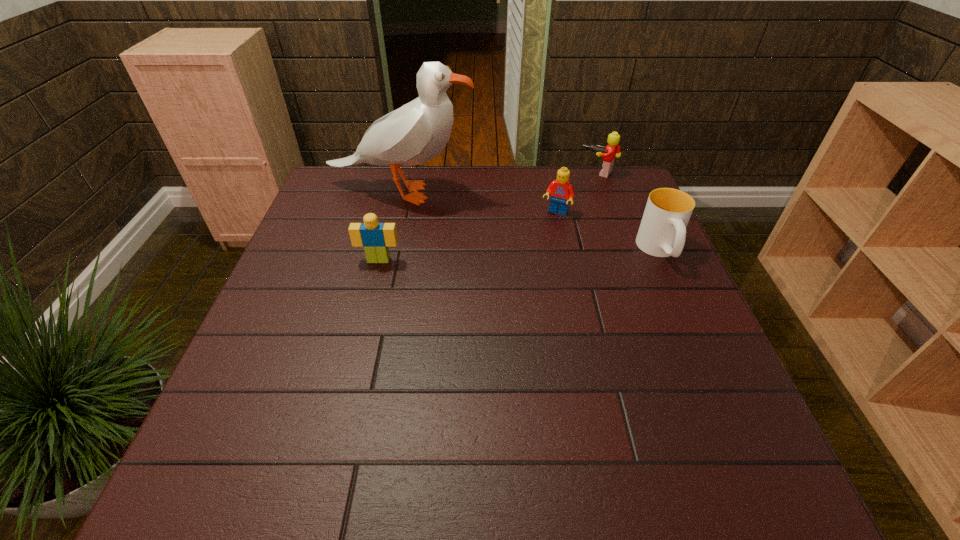
You are a GUI agent. You are given a task and a screenshot of the screen. Output one action in this format:
    pyautogui.click(x=<x>, y=<y>)
    Task: Click on the Lego that is at the right edge
    Image resolution: width=960 pixels, height=540 pixels.
    Given the screenshot: What is the action you would take?
    pyautogui.click(x=612, y=150)

Locate an element on the screen. This screenshot has height=540, width=960. object present at the far left corner is located at coordinates (415, 133).

Find the location of `object at the far right corner`. object at the far right corner is located at coordinates (612, 150).

Where is `free space at the far edge of the desktop`? Image resolution: width=960 pixels, height=540 pixels. free space at the far edge of the desktop is located at coordinates (477, 201).

At what (x,y) coordinates should I click in order to perform the action: click on vacant point at the near edge. Please return your answer as a coordinate pair (x, y). Image resolution: width=960 pixels, height=540 pixels. Looking at the image, I should click on (521, 426).

This screenshot has width=960, height=540. What are the coordinates of `vacant space at the left edge of the desktop` in the screenshot? It's located at (297, 246).

Where is `free space at the right edge of the desktop`? The width and height of the screenshot is (960, 540). free space at the right edge of the desktop is located at coordinates (715, 367).

You are a GUI agent. You are given a task and a screenshot of the screen. Output one action in this format:
    pyautogui.click(x=<x>, y=<y>)
    Task: Click on the vacant area at the far left corner
    
    Given the screenshot: What is the action you would take?
    pyautogui.click(x=355, y=180)

Locate an element on the screen. The image size is (960, 540). free space at the near left corner of the desktop is located at coordinates (246, 402).

The height and width of the screenshot is (540, 960). What are the coordinates of `unoccupied position between the second nearest Lego and the gull` in the screenshot? It's located at coord(478,203).